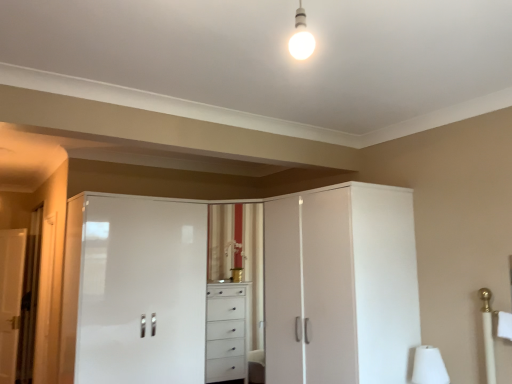
Question: Is white glossy door at left next to white glossy cabinet at center, the second screen door positioned from the left, and touching it?

Choices:
 (A) no
 (B) yes

Answer: (A)

Question: Is white glossy door at left positioned beyond the bounds of white glossy cabinet at center, the second screen door positioned from the left?

Choices:
 (A) no
 (B) yes

Answer: (B)

Question: Is white glossy door at left positioned before white glossy cabinet at center, the second screen door positioned from the left?

Choices:
 (A) no
 (B) yes

Answer: (A)

Question: From the image's perspective, is white glossy door at left under white glossy cabinet at center, the second screen door positioned from the left?

Choices:
 (A) yes
 (B) no

Answer: (A)

Question: Is white glossy door at left shorter than white glossy cabinet at center, which is the first screen door from right to left?

Choices:
 (A) no
 (B) yes

Answer: (A)

Question: Does white glossy door at left have a lesser width compared to white glossy cabinet at center, the second screen door positioned from the left?

Choices:
 (A) no
 (B) yes

Answer: (B)

Question: Considering the relative positions of white matte table lamp at lower right and white glossy cabinet at center, which is the first screen door from right to left, in the image provided, is white matte table lamp at lower right to the right of white glossy cabinet at center, which is the first screen door from right to left, from the viewer's perspective?

Choices:
 (A) yes
 (B) no

Answer: (A)

Question: Is white matte table lamp at lower right positioned before white glossy cabinet at center, the second screen door positioned from the left?

Choices:
 (A) yes
 (B) no

Answer: (B)

Question: Is white matte table lamp at lower right facing towards white glossy cabinet at center, which is the first screen door from right to left?

Choices:
 (A) no
 (B) yes

Answer: (A)

Question: Is white matte table lamp at lower right far from white glossy cabinet at center, the second screen door positioned from the left?

Choices:
 (A) yes
 (B) no

Answer: (B)

Question: Is white matte table lamp at lower right outside of white glossy cabinet at center, the second screen door positioned from the left?

Choices:
 (A) yes
 (B) no

Answer: (A)

Question: From a real-world perspective, does white matte table lamp at lower right stand above white glossy cabinet at center, the second screen door positioned from the left?

Choices:
 (A) no
 (B) yes

Answer: (A)

Question: Can you confirm if white matte table lamp at lower right is wider than white glossy door at left?

Choices:
 (A) no
 (B) yes

Answer: (B)